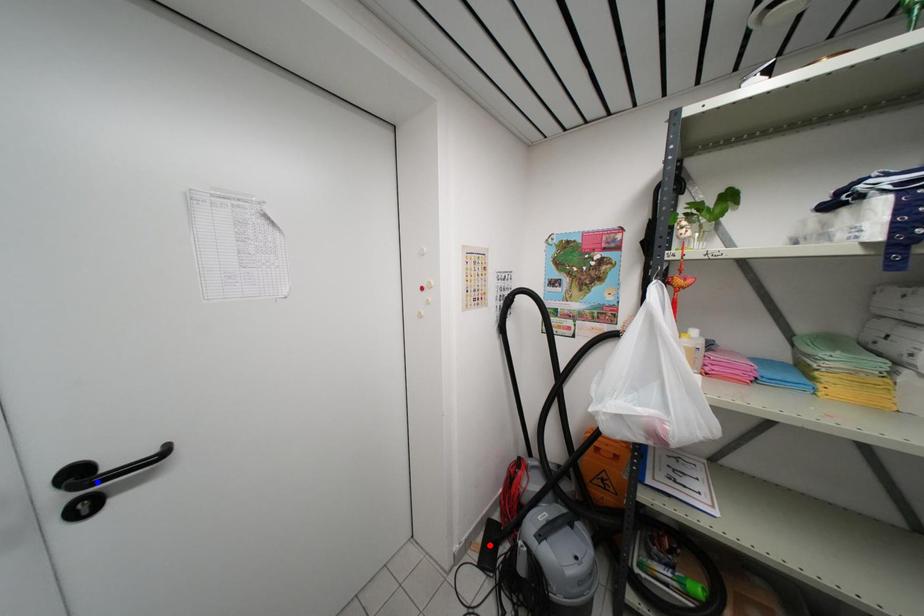
Question: Which of the two points in the image is closer to the camera?

Choices:
 (A) Blue point is closer.
 (B) Red point is closer.

Answer: (A)